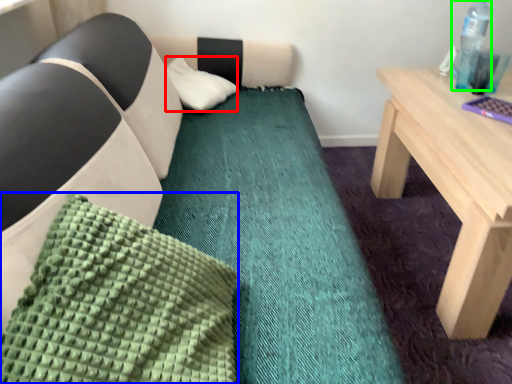
Question: Based on their relative distances, which object is farther from pillow (highlighted by a red box)? Choose from pillow (highlighted by a blue box) and bottle (highlighted by a green box).

Choices:
 (A) pillow
 (B) bottle

Answer: (A)